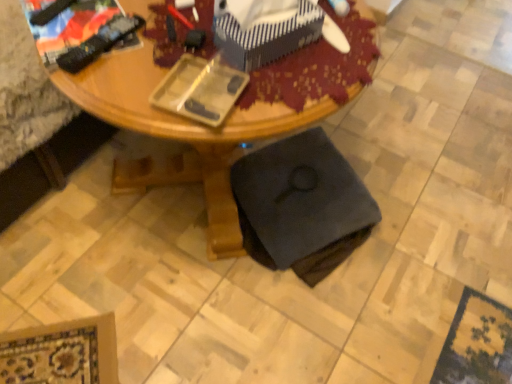
This screenshot has height=384, width=512. Find the location of `free space to the right of black fabric swivel chair at lower center`. free space to the right of black fabric swivel chair at lower center is located at coordinates (423, 231).